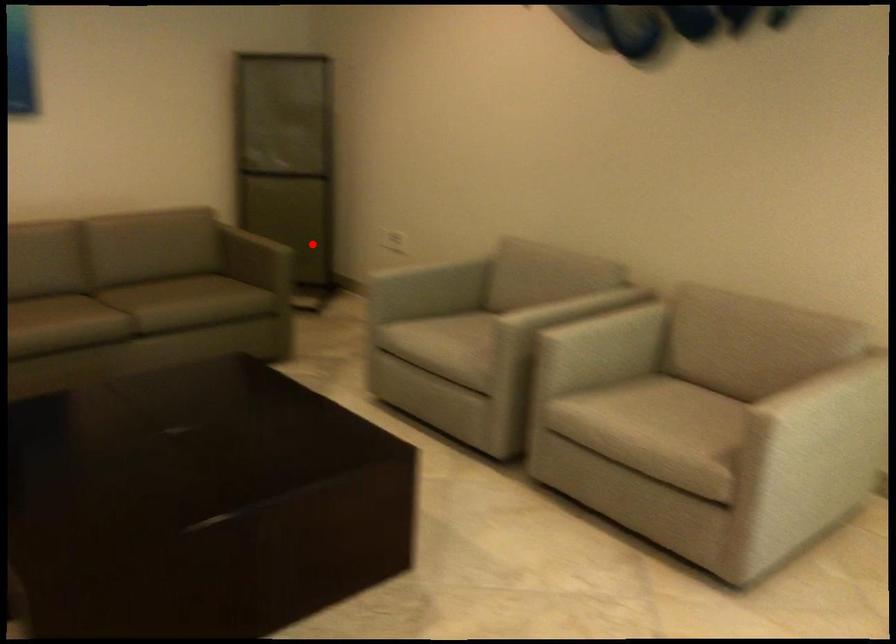
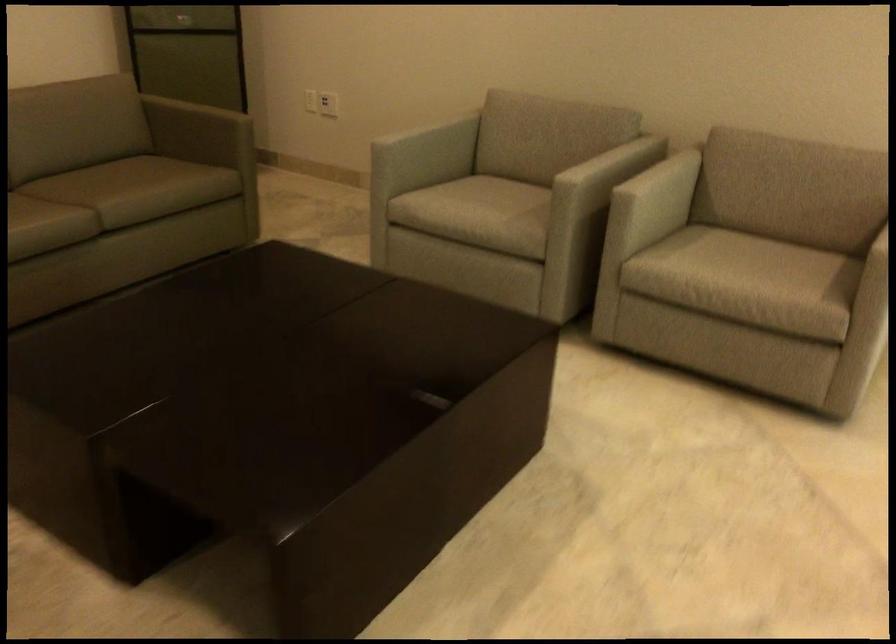
Find the pixel in the second image that matches the highlighted location in the first image.

(227, 114)